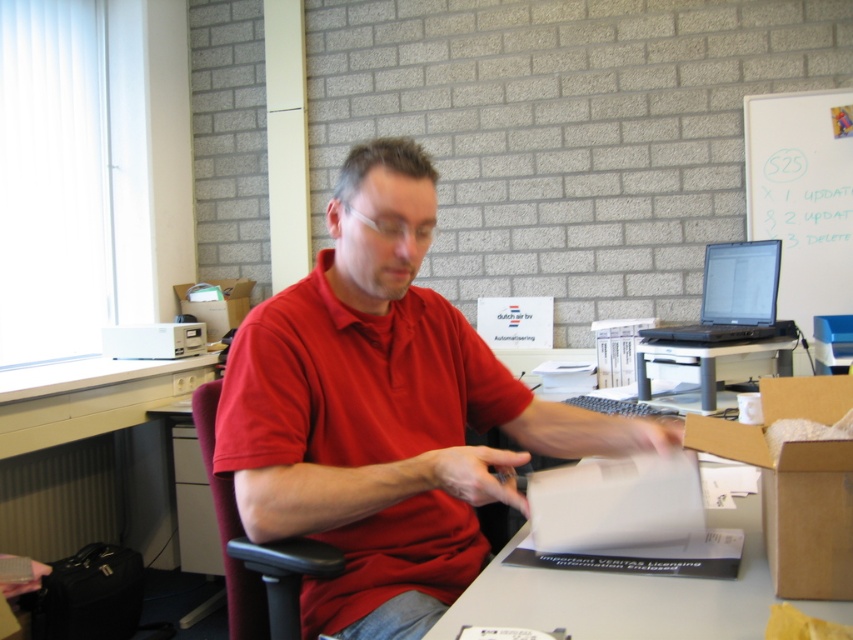
Question: Based on their relative distances, which object is farther from the white plastic computer desk at lower left?

Choices:
 (A) black matte laptop at upper right
 (B) brown cardboard box at lower right
 (C) black plastic chair at center

Answer: (B)

Question: Does white plastic computer desk at lower left appear on the left side of black plastic chair at center?

Choices:
 (A) yes
 (B) no

Answer: (A)

Question: Is matte red shirt at center thinner than white paper at center?

Choices:
 (A) yes
 (B) no

Answer: (B)

Question: Which object is the closest to the brown cardboard box at lower right?

Choices:
 (A) black plastic chair at center
 (B) white paper at center

Answer: (B)

Question: Can you confirm if white paper at center is positioned above brown cardboard box at lower right?

Choices:
 (A) no
 (B) yes

Answer: (A)

Question: Which point is closer to the camera taking this photo?

Choices:
 (A) [x=779, y=586]
 (B) [x=763, y=307]

Answer: (A)